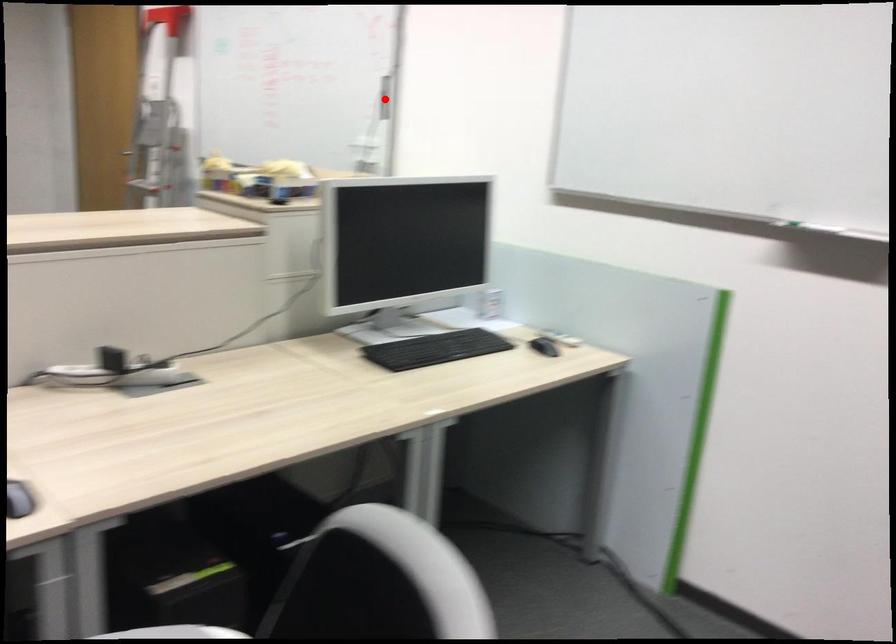
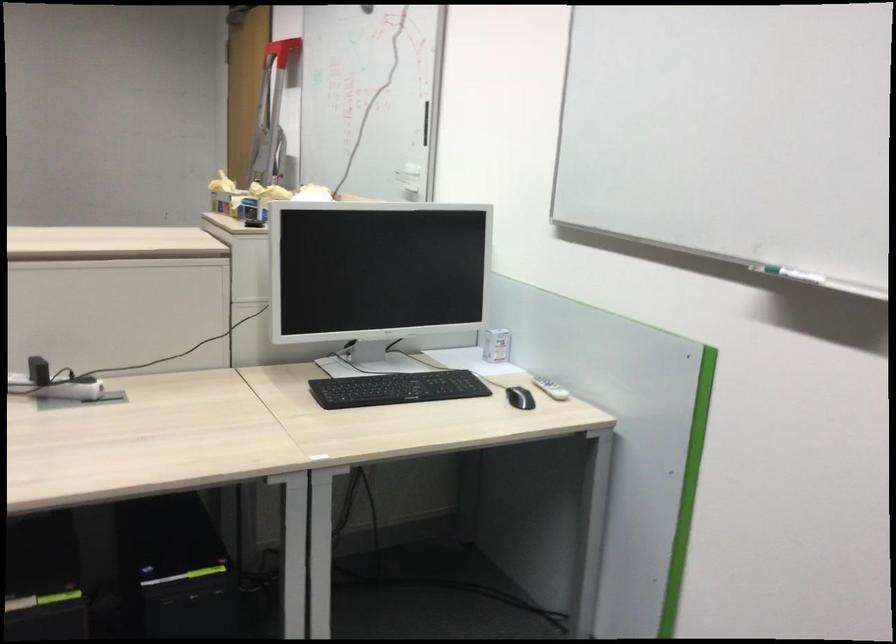
In the second image, find the point that corresponds to the highlighted location in the first image.

(426, 122)